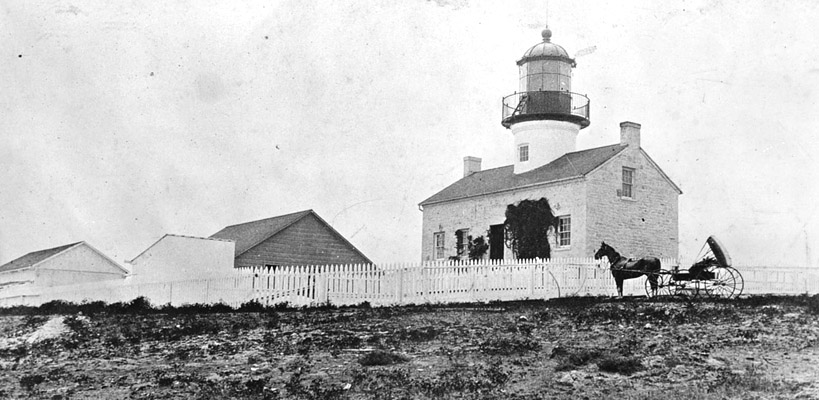
Find the location of a particular element. The image size is (819, 400). sashed windows is located at coordinates (562, 224), (439, 241), (627, 189).